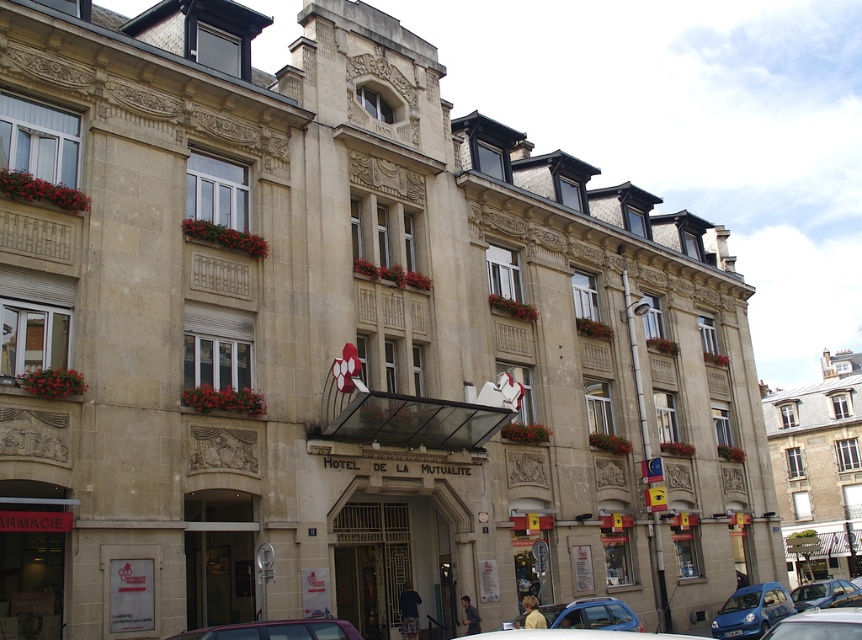
You are standing at the entrance of the building and want to park your car. The parking spot you want is located at coordinate point 0.955, 0.872. Is the blue metallic car at lower right blocking your parking spot?

The blue metallic car at lower right is exactly at point (751, 611), so it is blocking your parking spot.

You are standing at the entrance of the Hotel de la Mutualite and looking at the facade. There are two points marked on the building, one at coordinates point (753,593) and another at point (778,637). Which point do you think is closer to you?

Point (753,593) is further to the camera than point (778,637), so the point closer to you is point (778,637).

You are a guest arriving at the Hotel de la Mutualite and need to park your car. You see a metallic silver car at center and a metallic blue car at lower right. Which parking spot is closer to the entrance?

The metallic silver car at center is closer to the entrance because it is positioned to the left of the metallic blue car at lower right, which is further away from the entrance.